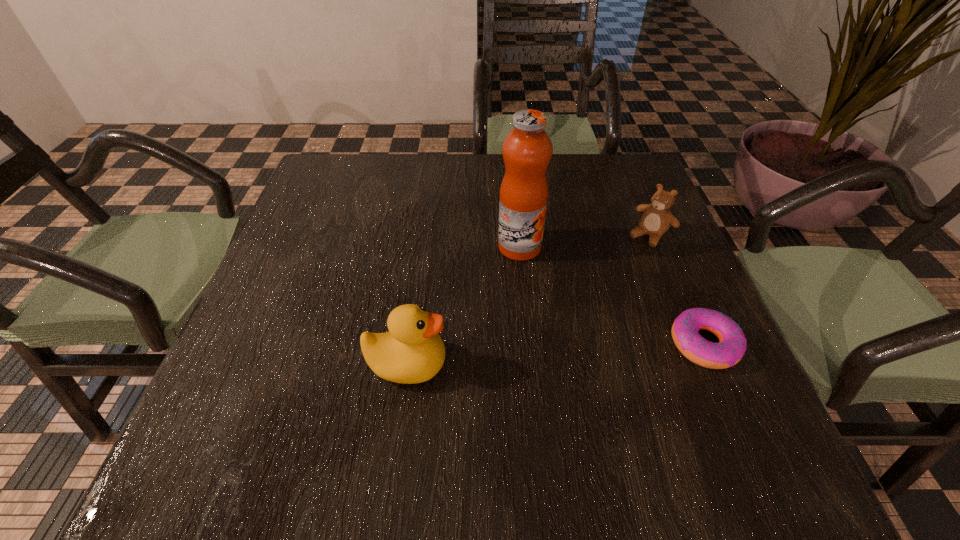
This screenshot has height=540, width=960. What are the coordinates of `the third shortest object` in the screenshot? It's located at (412, 351).

You are a GUI agent. You are given a task and a screenshot of the screen. Output one action in this format:
    pyautogui.click(x=<x>, y=<y>)
    Task: Click on the leftmost object
    
    Given the screenshot: What is the action you would take?
    pyautogui.click(x=412, y=351)

I want to click on the shortest object, so click(732, 343).

Locate an element on the screen. fruit juice is located at coordinates (527, 149).

Find the location of a particular element. the second object from left to right is located at coordinates (527, 149).

The width and height of the screenshot is (960, 540). I want to click on the third tallest object, so click(656, 219).

Locate an element on the screen. This screenshot has height=540, width=960. vacant space located at the beak of the leftmost object is located at coordinates (641, 364).

Find the location of a particular element. This screenshot has height=540, width=960. free region located on the back of the doughnut is located at coordinates (660, 241).

I want to click on vacant space located on the front label of the second object from left to right, so click(x=555, y=302).

Where is `vacant point located 0.360m on the front label of the second object from left to right`? The image size is (960, 540). vacant point located 0.360m on the front label of the second object from left to right is located at coordinates (616, 399).